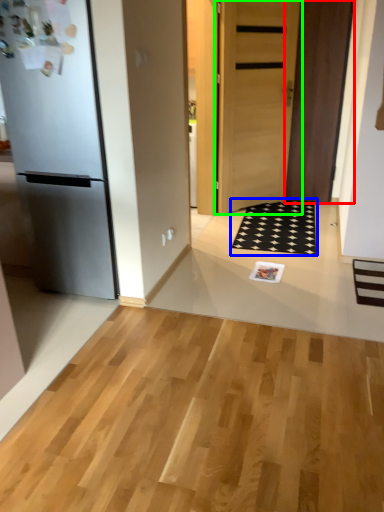
Question: Which is nearer to the door (highlighted by a red box)? doormat (highlighted by a blue box) or door (highlighted by a green box).

Choices:
 (A) doormat
 (B) door

Answer: (B)